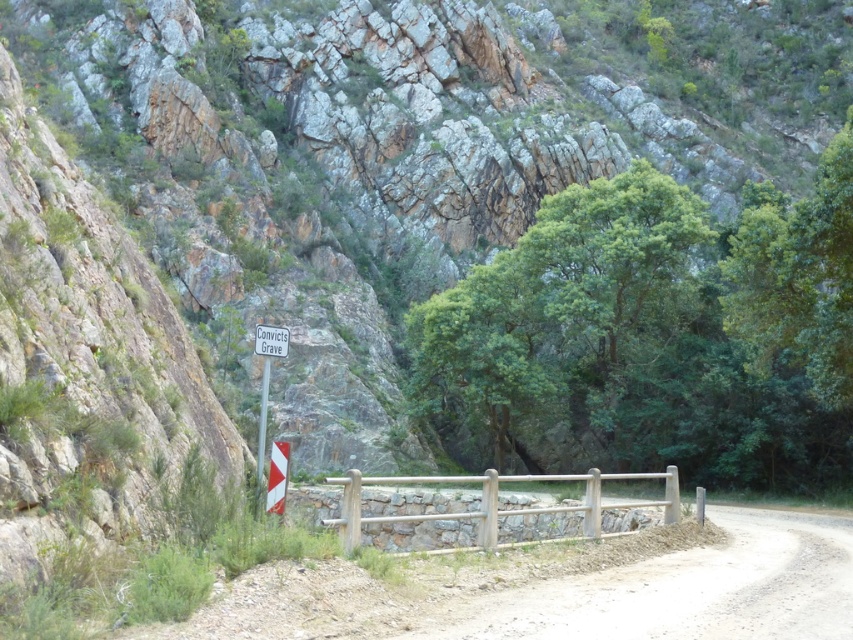
Is wooden fence at center to the right of white plastic triangle at center from the viewer's perspective?

Correct, you'll find wooden fence at center to the right of white plastic triangle at center.

Is the position of wooden fence at center less distant than that of white plastic triangle at center?

Yes, wooden fence at center is closer to the viewer.

Is point (506, 512) positioned before point (282, 480)?

No.

The image size is (853, 640). Identify the location of wooden fence at center. (479, 509).

Between dusty gravel road at center and white plastic signpost at center, which one is positioned lower?

dusty gravel road at center is below.

How far apart are dusty gravel road at center and white plastic signpost at center?

dusty gravel road at center and white plastic signpost at center are 7.30 meters apart from each other.

Between point (398, 600) and point (260, 461), which one is positioned in front?

Point (398, 600) is more forward.

Find the location of a particular element. The width and height of the screenshot is (853, 640). dusty gravel road at center is located at coordinates (566, 593).

Can you confirm if white plastic sign at lower left is wider than white plastic sign at center?

Correct, the width of white plastic sign at lower left exceeds that of white plastic sign at center.

Is white plastic sign at lower left bigger than white plastic sign at center?

Indeed, white plastic sign at lower left has a larger size compared to white plastic sign at center.

Does point (270, 369) come farther from viewer compared to point (260, 328)?

That is True.

The height and width of the screenshot is (640, 853). I want to click on white plastic sign at lower left, so click(265, 380).